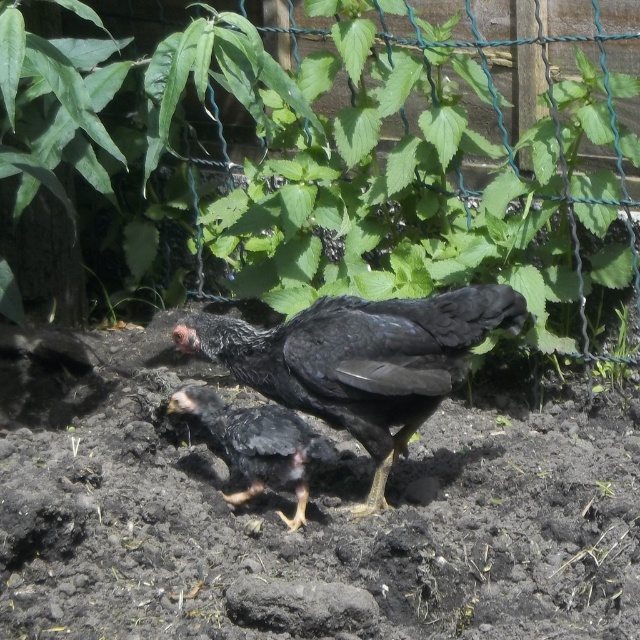
You are standing in a garden and see the shiny black chicken at center. There is a point at coordinates (360,360). Is this point located on the shiny black chicken at center?

Yes, the point at coordinates (360,360) is located on the shiny black chicken at center according to the description.

You are a gardener who wants to plant a new flower that requires at least 3 feet of space between it and any nearby plants. You have a spot between the green leafy plant at center and the shiny black chicken at center. Is there enough space for the flower?

The green leafy plant at center is much taller than the shiny black chicken at center, but the description does not provide information about the horizontal distance between them. Therefore, it is unclear if there is enough space for the flower.

What is located at the point with coordinates (330, 156) in the image?

The point at coordinates (330, 156) indicates a green leafy plant at center.